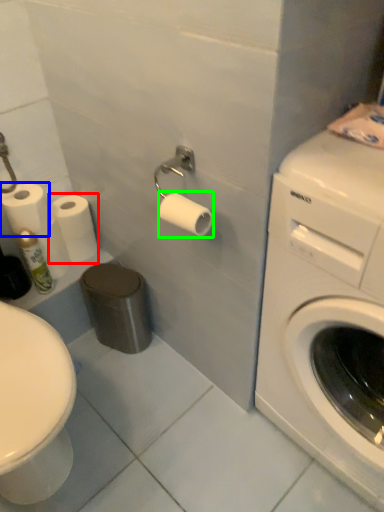
Question: Considering the real-world distances, which object is farthest from toilet paper (highlighted by a red box)? toilet paper (highlighted by a blue box) or toilet paper (highlighted by a green box)?

Choices:
 (A) toilet paper
 (B) toilet paper

Answer: (B)